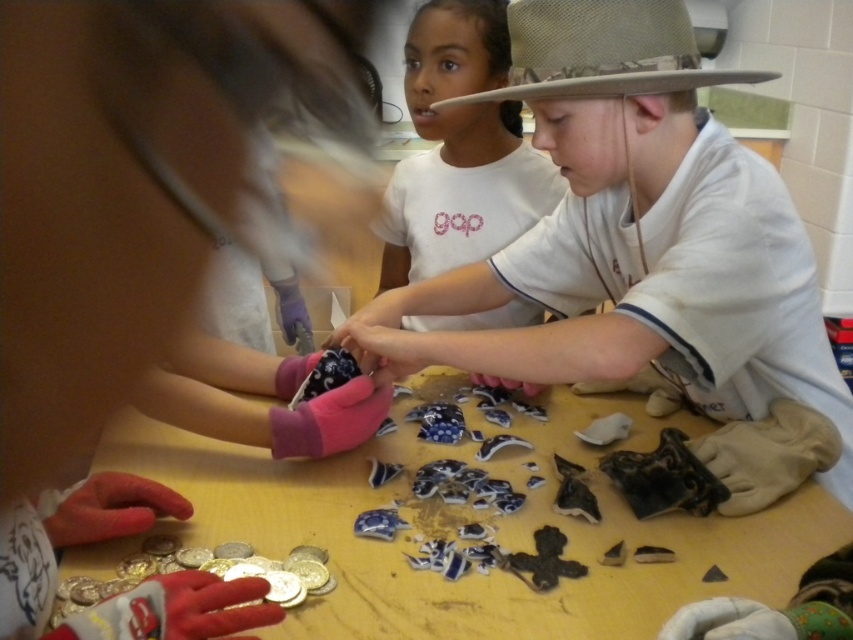
Question: Among these objects, which one is farthest from the camera?

Choices:
 (A) wooden table at center
 (B) matte white shirt at center
 (C) camouflage fabric cowboy hat at upper center

Answer: (B)

Question: Does matte white shirt at center have a smaller size compared to wooden table at center?

Choices:
 (A) no
 (B) yes

Answer: (A)

Question: Which is nearer to the matte white shirt at center?

Choices:
 (A) camouflage fabric cowboy hat at upper center
 (B) white cotton shirt at center

Answer: (A)

Question: Does matte white shirt at center have a greater width compared to camouflage fabric cowboy hat at upper center?

Choices:
 (A) yes
 (B) no

Answer: (A)

Question: Which point is farther from the camera taking this photo?

Choices:
 (A) (329, 461)
 (B) (424, 83)
 (C) (718, 74)
 (D) (561, 138)

Answer: (B)

Question: Is matte white shirt at center positioned behind wooden table at center?

Choices:
 (A) yes
 (B) no

Answer: (A)